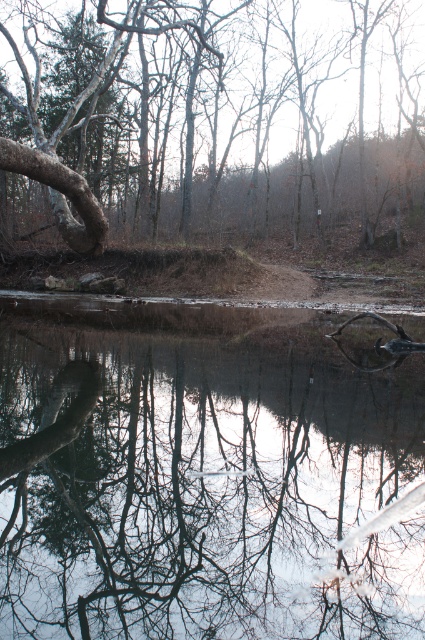
Question: Among these points, which one is farthest from the camera?

Choices:
 (A) (23, 154)
 (B) (57, 634)

Answer: (A)

Question: Can you confirm if transparent glass lake at center is positioned above smooth bark tree at center?

Choices:
 (A) yes
 (B) no

Answer: (B)

Question: Is transparent glass lake at center bigger than smooth bark tree at center?

Choices:
 (A) no
 (B) yes

Answer: (A)

Question: Which point is closer to the camera?

Choices:
 (A) smooth bark tree at center
 (B) transparent glass lake at center

Answer: (B)

Question: Is transparent glass lake at center wider than smooth bark tree at center?

Choices:
 (A) no
 (B) yes

Answer: (A)

Question: Which of the following is the closest to the observer?

Choices:
 (A) (317, 192)
 (B) (184, 308)

Answer: (B)